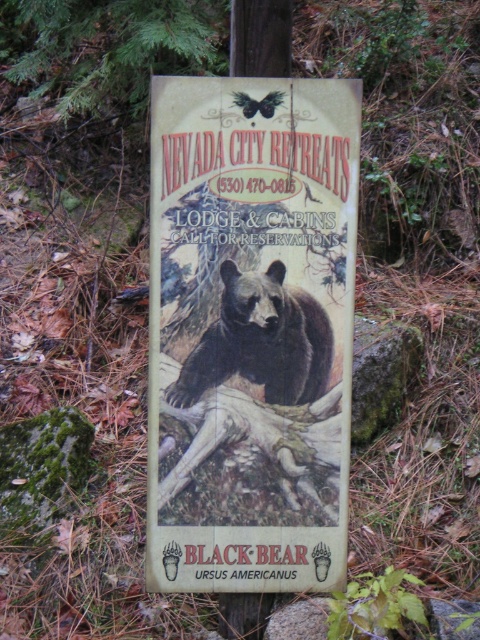
You are a hiker who needs to read the contact information on the wooden signboard at center and the wooden sign at center. Which one is taller so you can reach it more easily?

The wooden signboard at center is taller than the wooden sign at center, so you can reach it more easily.

You are a hiker who just arrived at the trailhead and see the wooden signboard at center and the brown fur bear at center. Which object is closer to you?

The wooden signboard at center is closer to you because it is in front of the brown fur bear at center.

You are standing in front of the wooden signboard and notice the brown fur bear at center. Which direction should you turn your head to look at the wooden sign at center first if you want to see both the bear and the sign?

You should turn your head to the right to look at the wooden sign at center first because the brown fur bear at center is to the left of it.